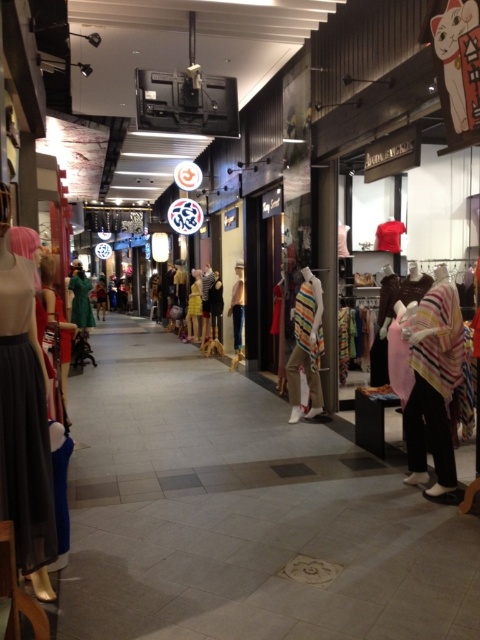
Does striped fabric vest at center have a greater width compared to green matte coat at center?

No, striped fabric vest at center is not wider than green matte coat at center.

Is point (295, 408) closer to camera compared to point (69, 285)?

Yes, it is.

Locate an element on the screen. The image size is (480, 640). striped fabric vest at center is located at coordinates (305, 346).

Measure the distance from white cotton shirt at center to yellow fabric dress at center.

They are 8.01 feet apart.

Locate an element on the screen. The width and height of the screenshot is (480, 640). white cotton shirt at center is located at coordinates (238, 307).

Is point (240, 316) positioned in front of point (194, 314)?

That is True.

Image resolution: width=480 pixels, height=640 pixels. I want to click on white cotton shirt at center, so click(x=238, y=307).

Does point (75, 316) come behind point (193, 288)?

No, (75, 316) is in front of (193, 288).

The image size is (480, 640). I want to click on green matte coat at center, so click(x=81, y=300).

Locate an element on the screen. green matte coat at center is located at coordinates (81, 300).